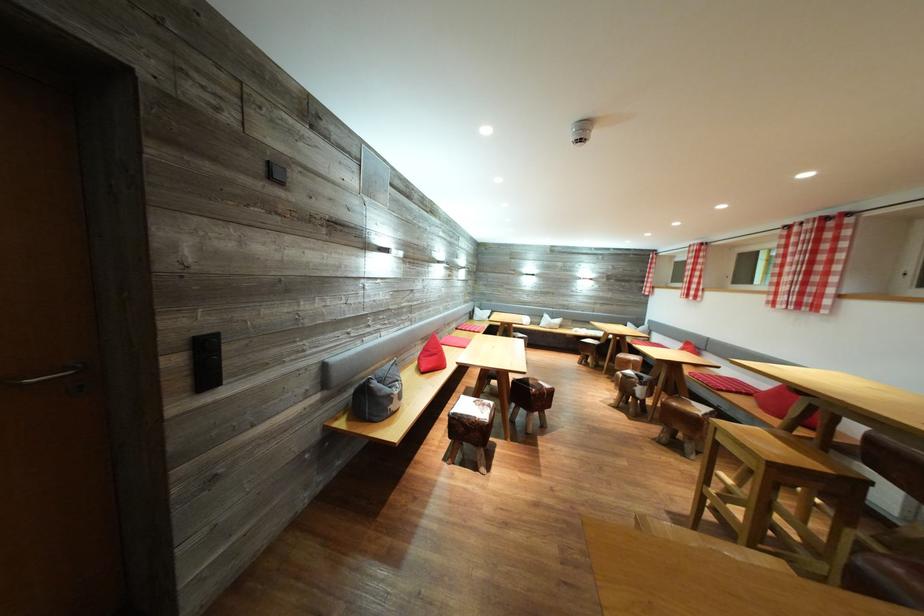
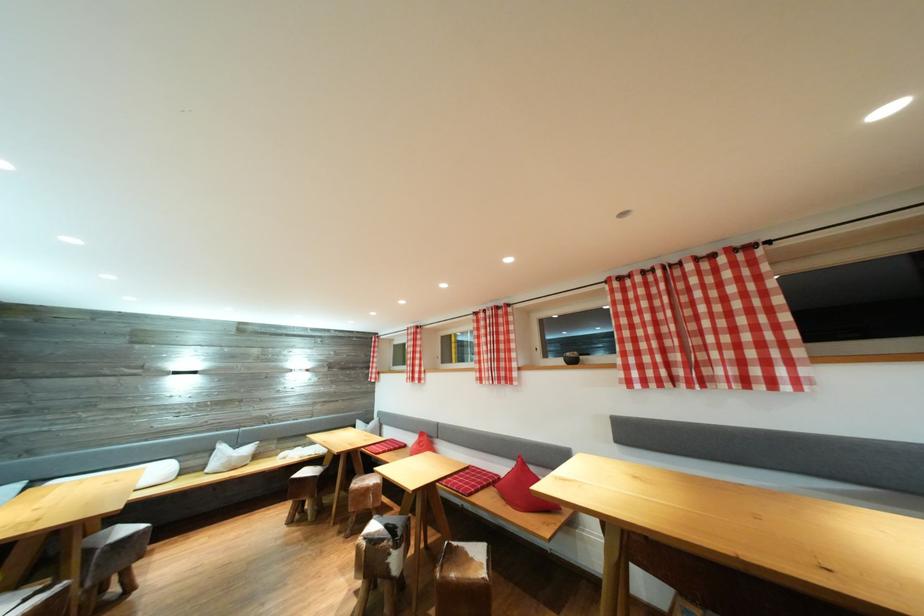
Find the pixel in the second image that matches [636,367] in the first image.

(373, 496)